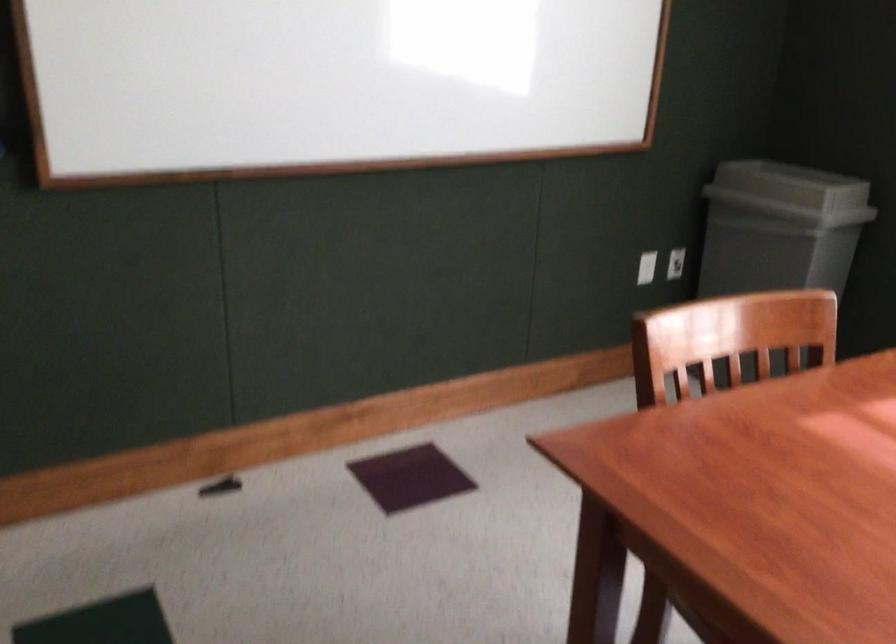
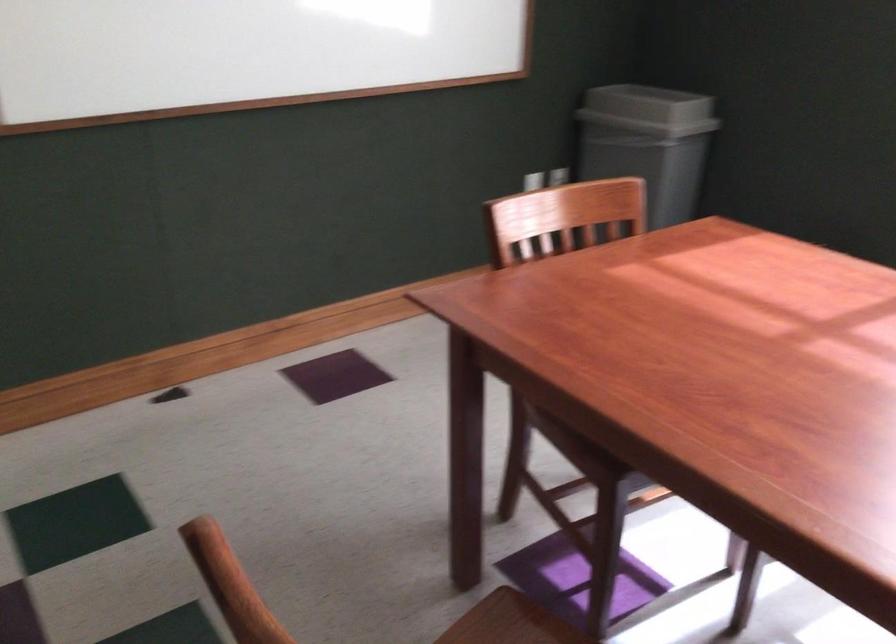
Question: Based on the continuous images, in which direction is the camera rotating? Reply with the corresponding letter.

Choices:
 (A) Left
 (B) Right
 (C) Up
 (D) Down

Answer: (B)